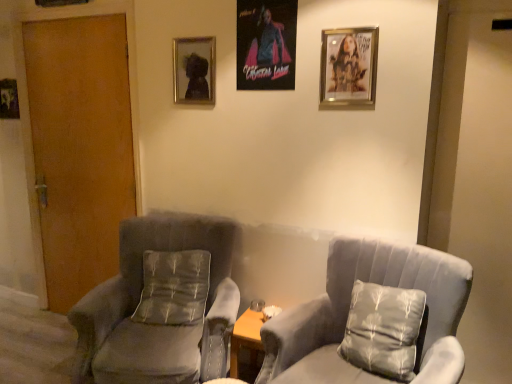
Question: From a real-world perspective, is silky gray pillow at center, which is the 1th pillow in back-to-front order, below wooden door at left?

Choices:
 (A) no
 (B) yes

Answer: (B)

Question: Does silky gray pillow at center, the 2th pillow in the right-to-left sequence, have a greater height compared to wooden door at left?

Choices:
 (A) yes
 (B) no

Answer: (B)

Question: Is the depth of silky gray pillow at center, acting as the second pillow starting from the front, greater than that of wooden door at left?

Choices:
 (A) yes
 (B) no

Answer: (B)

Question: Does silky gray pillow at center, acting as the second pillow starting from the front, appear on the left side of wooden door at left?

Choices:
 (A) yes
 (B) no

Answer: (B)

Question: Considering the relative sizes of silky gray pillow at center, which is the 1th pillow in back-to-front order, and wooden door at left in the image provided, is silky gray pillow at center, which is the 1th pillow in back-to-front order, shorter than wooden door at left?

Choices:
 (A) no
 (B) yes

Answer: (B)

Question: Considering the relative positions of silky gray pillow at center, acting as the second pillow starting from the front, and wooden door at left in the image provided, is silky gray pillow at center, acting as the second pillow starting from the front, to the right of wooden door at left from the viewer's perspective?

Choices:
 (A) no
 (B) yes

Answer: (B)

Question: From the image's perspective, is suede gray chair at center, arranged as the 2th chair when viewed from the left, below wooden door at left?

Choices:
 (A) yes
 (B) no

Answer: (A)

Question: Is suede gray chair at center, acting as the 1th chair starting from the right, far away from wooden door at left?

Choices:
 (A) yes
 (B) no

Answer: (A)

Question: Is suede gray chair at center, arranged as the 2th chair when viewed from the left, taller than wooden door at left?

Choices:
 (A) yes
 (B) no

Answer: (B)

Question: Is suede gray chair at center, arranged as the 2th chair when viewed from the left, thinner than wooden door at left?

Choices:
 (A) no
 (B) yes

Answer: (A)

Question: Could you tell me if suede gray chair at center, acting as the 1th chair starting from the right, is turned towards wooden door at left?

Choices:
 (A) no
 (B) yes

Answer: (A)

Question: Is suede gray chair at center, acting as the 1th chair starting from the right, to the right of wooden door at left from the viewer's perspective?

Choices:
 (A) yes
 (B) no

Answer: (A)

Question: Is metallic silver picture frame at left, which appears as the first picture frame when viewed from the left, thinner than metallic silver picture frame at upper center, positioned as the 2th picture frame in back-to-front order?

Choices:
 (A) no
 (B) yes

Answer: (B)